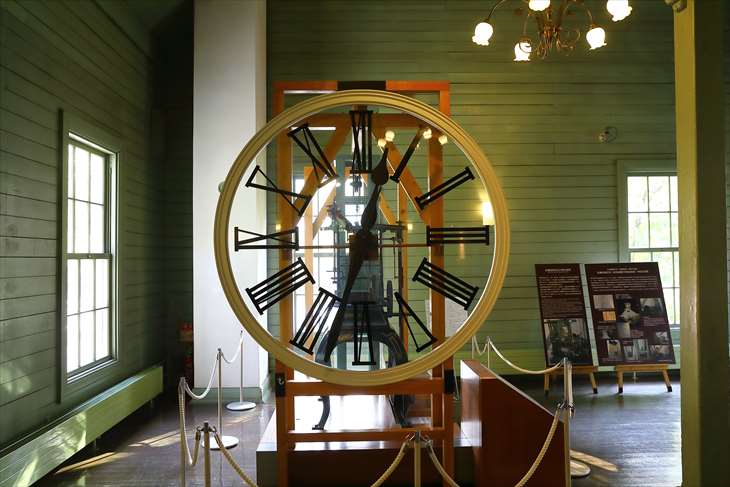
This screenshot has width=730, height=487. Find the location of `window frame`. window frame is located at coordinates (622, 178), (298, 161), (82, 136).